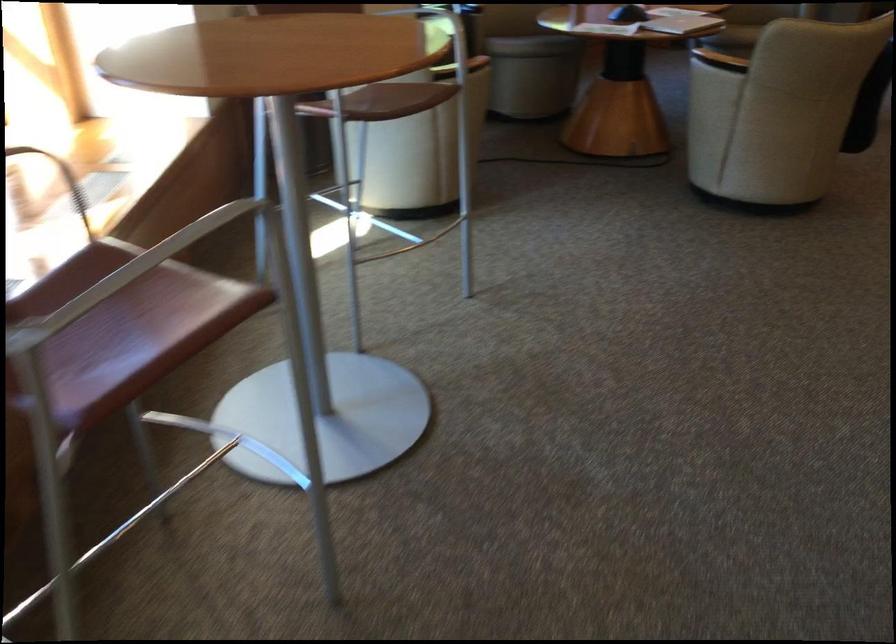
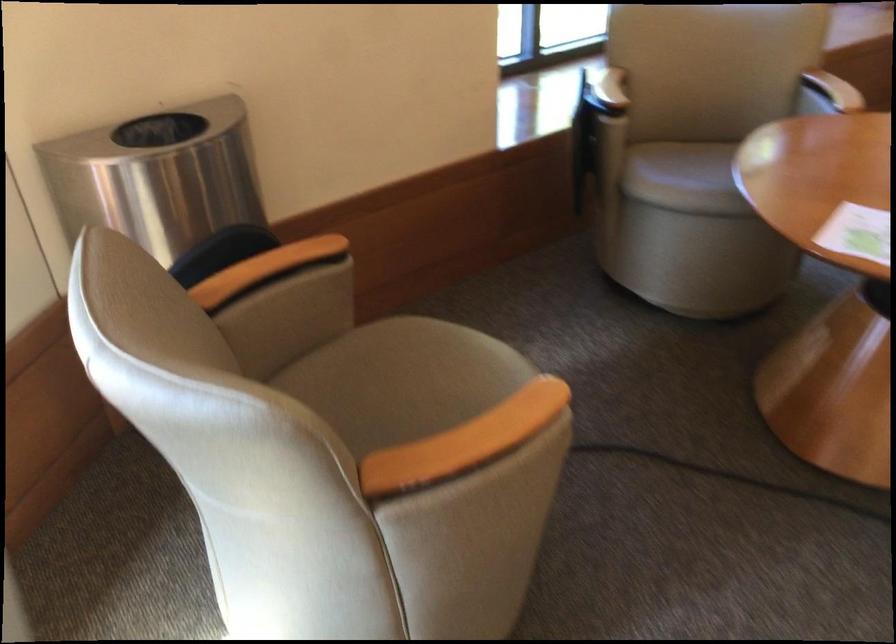
Question: In a continuous first-person perspective shot, in which direction is the camera moving?

Choices:
 (A) Left
 (B) Right
 (C) Forward
 (D) Backward

Answer: (C)